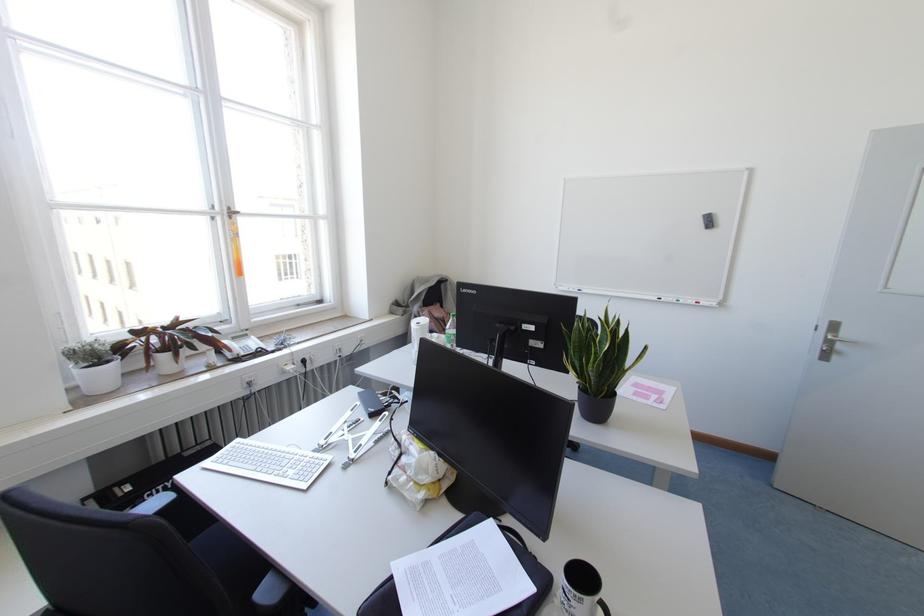
Find where to pull the metal window handle. Please return your answer as a coordinate pair (x, y).

(232, 214)